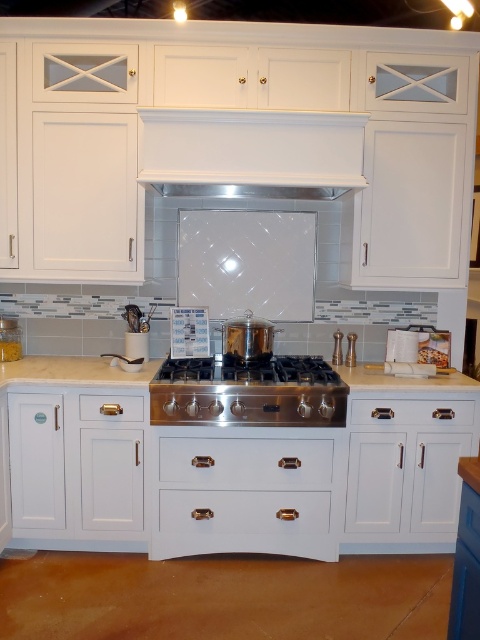
Question: Is white glossy exhaust hood at center positioned in front of white marble countertop at center?

Choices:
 (A) yes
 (B) no

Answer: (A)

Question: Can you confirm if white glossy exhaust hood at center is positioned above white marble countertop at center?

Choices:
 (A) no
 (B) yes

Answer: (B)

Question: Which object is farther from the camera taking this photo?

Choices:
 (A) brushed metal drawer at lower left
 (B) white wood drawer at center
 (C) satin brass drawer at center
 (D) white glossy exhaust hood at center

Answer: (B)

Question: Which point is closer to the camera?

Choices:
 (A) white wood drawer at center
 (B) white marble countertop at center
 (C) white glossy exhaust hood at center
 (D) satin brass drawer at center

Answer: (C)

Question: Which of the following is the farthest from the observer?

Choices:
 (A) (97, 396)
 (B) (443, 403)
 (C) (249, 468)
 (D) (23, 380)

Answer: (B)

Question: Does white wood drawer at center lie in front of brushed metal drawer at lower left?

Choices:
 (A) yes
 (B) no

Answer: (B)